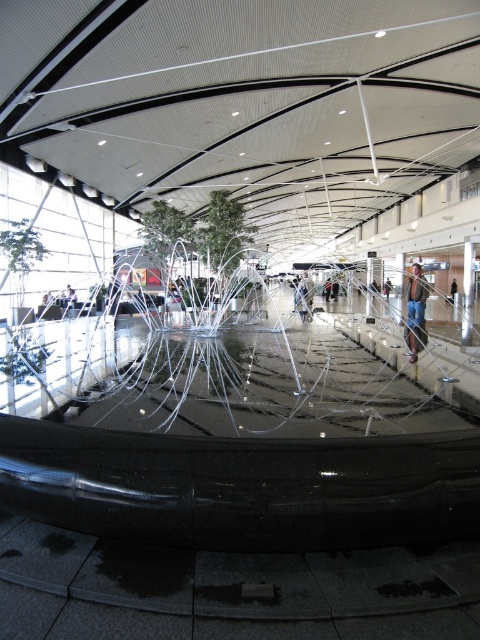
Question: Which point is farther to the camera?

Choices:
 (A) blue jeans at center
 (B) denim jacket at center

Answer: (B)

Question: Can you confirm if blue jeans at center is positioned below metallic silver person at center?

Choices:
 (A) no
 (B) yes

Answer: (A)

Question: Which point is farther to the camera?

Choices:
 (A) (455, 285)
 (B) (410, 353)
 (C) (305, 284)

Answer: (A)

Question: Which is nearer to the blue jeans at center?

Choices:
 (A) metallic silver person at center
 (B) denim jacket at center

Answer: (A)

Question: Is blue jeans at center further to the viewer compared to metallic silver person at center?

Choices:
 (A) yes
 (B) no

Answer: (B)

Question: From the image, what is the correct spatial relationship of blue jeans at center in relation to denim jacket at center?

Choices:
 (A) above
 (B) below

Answer: (B)